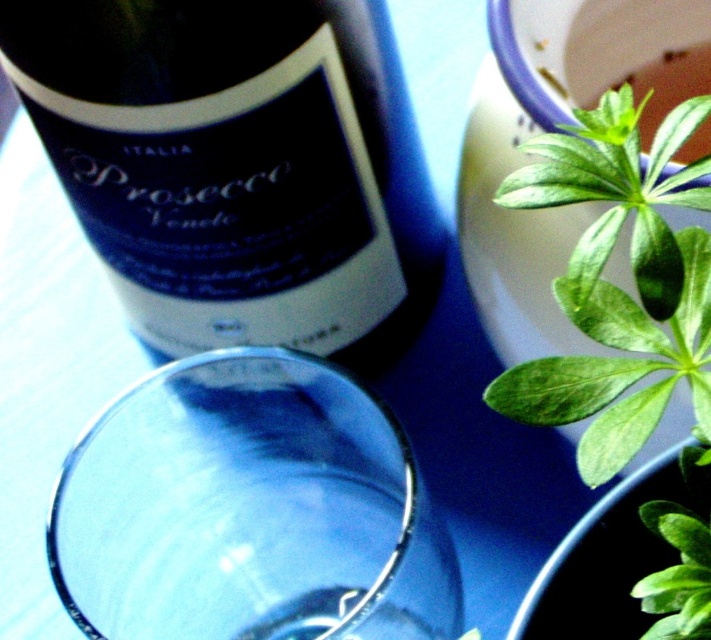
Question: Can you confirm if matte black bottle at upper left is positioned above green glossy leaf at upper right?

Choices:
 (A) no
 (B) yes

Answer: (B)

Question: Among these objects, which one is nearest to the camera?

Choices:
 (A) transparent glass at center
 (B) green glossy leaf at upper right

Answer: (B)

Question: Which point is farther to the camera?

Choices:
 (A) (710, 280)
 (B) (373, 35)
 (C) (374, 557)

Answer: (C)

Question: Which point is farther to the camera?

Choices:
 (A) (670, 307)
 (B) (348, 19)

Answer: (B)

Question: Can you confirm if transparent glass at center is positioned above matte black bottle at upper left?

Choices:
 (A) no
 (B) yes

Answer: (A)

Question: Can you confirm if transparent glass at center is smaller than matte black bottle at upper left?

Choices:
 (A) yes
 (B) no

Answer: (A)